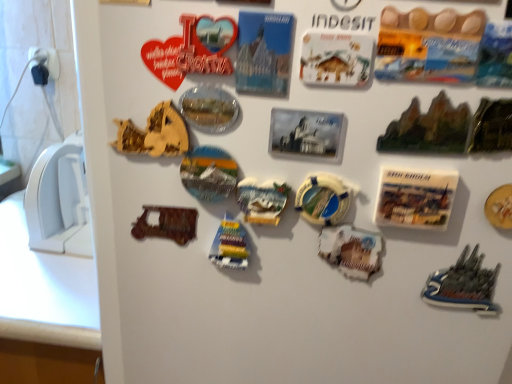
Locate an element on the screen. Image resolution: width=512 pixels, height=384 pixels. green glossy rock formation at upper right, the 6th stuff viewed from the left is located at coordinates (428, 128).

Measure the distance between point (x=370, y=232) and camera.

They are 19.06 inches apart.

Image resolution: width=512 pixels, height=384 pixels. Describe the element at coordinates (324, 199) in the screenshot. I see `yellow lifebuoy at center, the fourth stuff positioned from the right` at that location.

The image size is (512, 384). In order to click on yellow lifebuoy at center, the fourth stuff positioned from the right in this screenshot , I will do `click(324, 199)`.

Where is `white paper postcard at center right`? The height and width of the screenshot is (384, 512). white paper postcard at center right is located at coordinates (415, 198).

Identify the location of metallic silver magnet at center, which ranks as the third stuff in left-to-right order. The image size is (512, 384). (262, 200).

What are the coordinates of `green glossy rock formation at upper right, which is the 2th stuff in right-to-left order` in the screenshot? It's located at (428, 128).

From the image's perspective, is wooden puzzle piece at upper left, which is the 7th stuff from right to left, on top of white cardboard magnet at center, marked as the 3th stuff in a right-to-left arrangement?

Yes, from the image's perspective, wooden puzzle piece at upper left, which is the 7th stuff from right to left, is over white cardboard magnet at center, marked as the 3th stuff in a right-to-left arrangement.

Which point is more forward, (116, 148) or (364, 245)?

The point (116, 148) is more forward.

Considering the relative sizes of wooden puzzle piece at upper left, which is the 7th stuff from right to left, and white cardboard magnet at center, which appears as the 5th stuff when viewed from the left, in the image provided, is wooden puzzle piece at upper left, which is the 7th stuff from right to left, shorter than white cardboard magnet at center, which appears as the 5th stuff when viewed from the left,?

Yes, wooden puzzle piece at upper left, which is the 7th stuff from right to left, is shorter than white cardboard magnet at center, which appears as the 5th stuff when viewed from the left.

Could you measure the distance between wooden puzzle piece at upper left, which is the 7th stuff from right to left, and white cardboard magnet at center, marked as the 3th stuff in a right-to-left arrangement?

A distance of 8.73 inches exists between wooden puzzle piece at upper left, which is the 7th stuff from right to left, and white cardboard magnet at center, marked as the 3th stuff in a right-to-left arrangement.

Is yellow lifebuoy at center, which is counted as the 4th stuff, starting from the left, in front of wooden toy boat at center, marked as the 6th stuff in a right-to-left arrangement?

That is True.

Considering the sizes of objects yellow lifebuoy at center, which is counted as the 4th stuff, starting from the left, and wooden toy boat at center, marked as the 2th stuff in a left-to-right arrangement, in the image provided, who is bigger, yellow lifebuoy at center, which is counted as the 4th stuff, starting from the left, or wooden toy boat at center, marked as the 2th stuff in a left-to-right arrangement,?

Bigger between the two is wooden toy boat at center, marked as the 2th stuff in a left-to-right arrangement.

In the scene shown: From the image's perspective, which one is positioned lower, yellow lifebuoy at center, which is counted as the 4th stuff, starting from the left, or wooden toy boat at center, marked as the 6th stuff in a right-to-left arrangement?

wooden toy boat at center, marked as the 6th stuff in a right-to-left arrangement.

Which object is positioned more to the left, yellow lifebuoy at center, the fourth stuff positioned from the right, or wooden toy boat at center, marked as the 2th stuff in a left-to-right arrangement?

Positioned to the left is wooden toy boat at center, marked as the 2th stuff in a left-to-right arrangement.

Between wooden puzzle piece at upper left, which is the 7th stuff from right to left, and green glossy rock formation at upper right, the 6th stuff viewed from the left, which one has smaller width?

wooden puzzle piece at upper left, which is the 7th stuff from right to left, is thinner.

From the image's perspective, who appears lower, wooden puzzle piece at upper left, which is the 7th stuff from right to left, or green glossy rock formation at upper right, the 6th stuff viewed from the left?

green glossy rock formation at upper right, the 6th stuff viewed from the left.

From the green glossy rock formation at upper right, the 6th stuff viewed from the left, count 1st stuffs backward and point to it. Please provide its 2D coordinates.

[(154, 133)]

Looking at this image, does wooden puzzle piece at upper left, acting as the 1th stuff starting from the left, turn towards green glossy rock formation at upper right, which is the 2th stuff in right-to-left order?

No, wooden puzzle piece at upper left, acting as the 1th stuff starting from the left, is not oriented towards green glossy rock formation at upper right, which is the 2th stuff in right-to-left order.

Which object is thinner, green metallic rock at upper right, marked as the 1th stuff in a right-to-left arrangement, or wooden toy boat at center, marked as the 6th stuff in a right-to-left arrangement?

Thinner between the two is green metallic rock at upper right, marked as the 1th stuff in a right-to-left arrangement.

From the image's perspective, relative to wooden toy boat at center, marked as the 2th stuff in a left-to-right arrangement, is green metallic rock at upper right, marked as the 1th stuff in a right-to-left arrangement, above or below?

From the image's perspective, green metallic rock at upper right, marked as the 1th stuff in a right-to-left arrangement, appears above wooden toy boat at center, marked as the 2th stuff in a left-to-right arrangement.

Can wooden toy boat at center, marked as the 2th stuff in a left-to-right arrangement, be found inside green metallic rock at upper right, which is the seventh stuff in left-to-right order?

No, wooden toy boat at center, marked as the 2th stuff in a left-to-right arrangement, is not a part of green metallic rock at upper right, which is the seventh stuff in left-to-right order.

Is there a large distance between green metallic rock at upper right, which is the seventh stuff in left-to-right order, and wooden toy boat at center, marked as the 2th stuff in a left-to-right arrangement?

No, green metallic rock at upper right, which is the seventh stuff in left-to-right order, is in close proximity to wooden toy boat at center, marked as the 2th stuff in a left-to-right arrangement.

What's the angular difference between white paper postcard at center right and wooden puzzle piece at upper left, which is the 7th stuff from right to left,'s facing directions?

There is a 3.09-degree angle between the facing directions of white paper postcard at center right and wooden puzzle piece at upper left, which is the 7th stuff from right to left.

Does white paper postcard at center right turn towards wooden puzzle piece at upper left, acting as the 1th stuff starting from the left?

No, white paper postcard at center right does not turn towards wooden puzzle piece at upper left, acting as the 1th stuff starting from the left.

Between white paper postcard at center right and wooden puzzle piece at upper left, acting as the 1th stuff starting from the left, which one has larger size?

white paper postcard at center right.

From a real-world perspective, is metallic silver magnet at center, which ranks as the third stuff in left-to-right order, positioned over yellow lifebuoy at center, which is counted as the 4th stuff, starting from the left, based on gravity?

No, from a real-world perspective, metallic silver magnet at center, which ranks as the third stuff in left-to-right order, is not over yellow lifebuoy at center, which is counted as the 4th stuff, starting from the left

How much distance is there between metallic silver magnet at center, the fifth stuff positioned from the right, and yellow lifebuoy at center, which is counted as the 4th stuff, starting from the left?

metallic silver magnet at center, the fifth stuff positioned from the right, and yellow lifebuoy at center, which is counted as the 4th stuff, starting from the left, are 1.65 inches apart.

Between metallic silver magnet at center, the fifth stuff positioned from the right, and yellow lifebuoy at center, which is counted as the 4th stuff, starting from the left, which one has smaller width?

yellow lifebuoy at center, which is counted as the 4th stuff, starting from the left.

Is metallic silver magnet at center, the fifth stuff positioned from the right, positioned with its back to yellow lifebuoy at center, which is counted as the 4th stuff, starting from the left?

metallic silver magnet at center, the fifth stuff positioned from the right, does not have its back to yellow lifebuoy at center, which is counted as the 4th stuff, starting from the left.

Which of these two, white paper postcard at center right or dark gray plastic ship at lower right, is wider?

Wider between the two is dark gray plastic ship at lower right.

Is white paper postcard at center right at the right side of dark gray plastic ship at lower right?

No, white paper postcard at center right is not to the right of dark gray plastic ship at lower right.

How many degrees apart are the facing directions of white paper postcard at center right and dark gray plastic ship at lower right?

white paper postcard at center right and dark gray plastic ship at lower right are facing 0.0554 degrees away from each other.

Between point (435, 208) and point (469, 269), which one is positioned behind?

The point (469, 269) is farther.

You are a GUI agent. You are given a task and a screenshot of the screen. Output one action in this format:
    pyautogui.click(x=<x>, y=<y>)
    Task: Click on the stuff that is the 4th one below the wooden puzzle piece at upper left, which is the 7th stuff from right to left (from a real-world perspective)
    This screenshot has height=384, width=512.
    Given the screenshot: What is the action you would take?
    pyautogui.click(x=351, y=250)

Locate an element on the screen. Image resolution: width=512 pixels, height=384 pixels. the 2nd stuff below when counting from the yellow lifebuoy at center, which is counted as the 4th stuff, starting from the left (from the image's perspective) is located at coordinates click(230, 245).

Looking at the image, which one is located further to yellow lifebuoy at center, the fourth stuff positioned from the right, metallic silver magnet at center, the fifth stuff positioned from the right, or green metallic rock at upper right, which is the seventh stuff in left-to-right order?

Among the two, green metallic rock at upper right, which is the seventh stuff in left-to-right order, is located further to yellow lifebuoy at center, the fourth stuff positioned from the right.

Looking at the image, which one is located further to metallic silver magnet at center, which ranks as the third stuff in left-to-right order, green glossy rock formation at upper right, the 6th stuff viewed from the left, or white cardboard magnet at center, which appears as the 5th stuff when viewed from the left?

Among the two, green glossy rock formation at upper right, the 6th stuff viewed from the left, is located further to metallic silver magnet at center, which ranks as the third stuff in left-to-right order.

From the image, which object appears to be farther from green metallic rock at upper right, which is the seventh stuff in left-to-right order, white paper postcard at center right or white cardboard magnet at center, marked as the 3th stuff in a right-to-left arrangement?

Among the two, white cardboard magnet at center, marked as the 3th stuff in a right-to-left arrangement, is located further to green metallic rock at upper right, which is the seventh stuff in left-to-right order.

Estimate the real-world distances between objects in this image. Which object is further from wooden puzzle piece at upper left, which is the 7th stuff from right to left, white cardboard magnet at center, marked as the 3th stuff in a right-to-left arrangement, or green metallic rock at upper right, which is the seventh stuff in left-to-right order?

green metallic rock at upper right, which is the seventh stuff in left-to-right order.

From the image, which object appears to be nearer to green metallic rock at upper right, marked as the 1th stuff in a right-to-left arrangement, yellow lifebuoy at center, the fourth stuff positioned from the right, or white paper postcard at center right?

white paper postcard at center right lies closer to green metallic rock at upper right, marked as the 1th stuff in a right-to-left arrangement, than the other object.

Based on their spatial positions, is wooden puzzle piece at upper left, acting as the 1th stuff starting from the left, or green metallic rock at upper right, marked as the 1th stuff in a right-to-left arrangement, further from metallic silver magnet at center, which ranks as the third stuff in left-to-right order?

green metallic rock at upper right, marked as the 1th stuff in a right-to-left arrangement, is further to metallic silver magnet at center, which ranks as the third stuff in left-to-right order.

Which object lies further to the anchor point wooden toy boat at center, marked as the 2th stuff in a left-to-right arrangement, white cardboard magnet at center, marked as the 3th stuff in a right-to-left arrangement, or wooden puzzle piece at upper left, which is the 7th stuff from right to left?

wooden puzzle piece at upper left, which is the 7th stuff from right to left, is positioned further to the anchor wooden toy boat at center, marked as the 2th stuff in a left-to-right arrangement.

Looking at the image, which one is located closer to wooden puzzle piece at upper left, acting as the 1th stuff starting from the left, wooden toy boat at center, marked as the 6th stuff in a right-to-left arrangement, or metallic silver magnet at center, the fifth stuff positioned from the right?

Based on the image, metallic silver magnet at center, the fifth stuff positioned from the right, appears to be nearer to wooden puzzle piece at upper left, acting as the 1th stuff starting from the left.

This screenshot has height=384, width=512. I want to click on toy between metallic silver magnet at center, the fifth stuff positioned from the right, and green metallic rock at upper right, marked as the 1th stuff in a right-to-left arrangement, from left to right, so click(463, 285).

Identify the location of toy between wooden toy boat at center, marked as the 6th stuff in a right-to-left arrangement, and green metallic rock at upper right, marked as the 1th stuff in a right-to-left arrangement, from left to right. (463, 285).

Image resolution: width=512 pixels, height=384 pixels. In order to click on stuff between metallic silver magnet at center, the fifth stuff positioned from the right, and white cardboard magnet at center, marked as the 3th stuff in a right-to-left arrangement in this screenshot , I will do `click(324, 199)`.

At what (x,y) coordinates should I click in order to perform the action: click on postcard between metallic silver magnet at center, the fifth stuff positioned from the right, and green metallic rock at upper right, which is the seventh stuff in left-to-right order, from left to right. Please return your answer as a coordinate pair (x, y). Looking at the image, I should click on (415, 198).